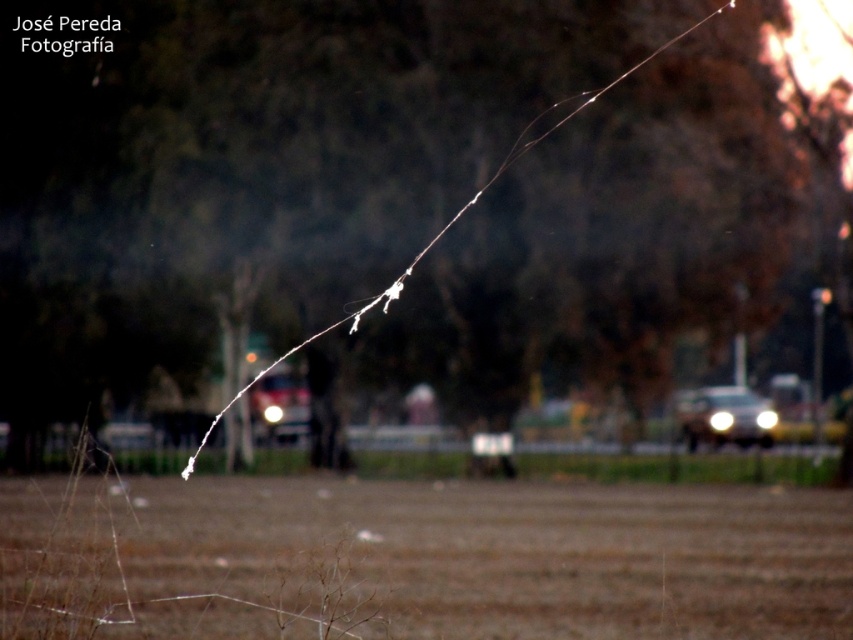
Who is higher up, brown soil at center or shiny silver car at right?

shiny silver car at right is above.

Image resolution: width=853 pixels, height=640 pixels. I want to click on brown soil at center, so click(x=485, y=557).

Identify the location of brown soil at center. The height and width of the screenshot is (640, 853). (485, 557).